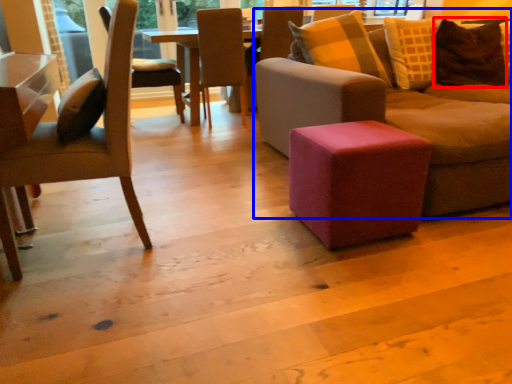
Question: Which object appears closest to the camera in this image, pillow (highlighted by a red box) or studio couch (highlighted by a blue box)?

Choices:
 (A) pillow
 (B) studio couch

Answer: (B)